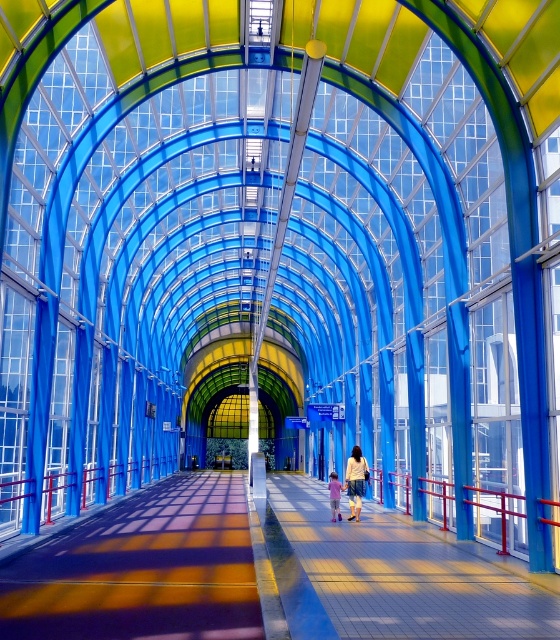
From the picture: Does smooth concrete floor at center appear over pastel pink fabric at center?

No, smooth concrete floor at center is not above pastel pink fabric at center.

Can you confirm if smooth concrete floor at center is positioned to the right of pastel pink fabric at center?

No, smooth concrete floor at center is not to the right of pastel pink fabric at center.

The width and height of the screenshot is (560, 640). Identify the location of smooth concrete floor at center. (142, 570).

Can you confirm if smooth concrete floor at center is smaller than denim shorts at center?

No, smooth concrete floor at center is not smaller than denim shorts at center.

Which of these two, smooth concrete floor at center or denim shorts at center, stands shorter?

denim shorts at center

Is point (128, 589) in front of point (360, 500)?

Yes, it is.

Locate an element on the screen. Image resolution: width=560 pixels, height=640 pixels. smooth concrete floor at center is located at coordinates (142, 570).

In the scene shown: Between smooth concrete walkway at center and pastel pink fabric at center, which one has more height?

smooth concrete walkway at center

Can you confirm if smooth concrete walkway at center is wider than pastel pink fabric at center?

Yes.

Find the location of a particular element. The width and height of the screenshot is (560, 640). smooth concrete walkway at center is located at coordinates (403, 573).

Locate an element on the screen. smooth concrete walkway at center is located at coordinates (403, 573).